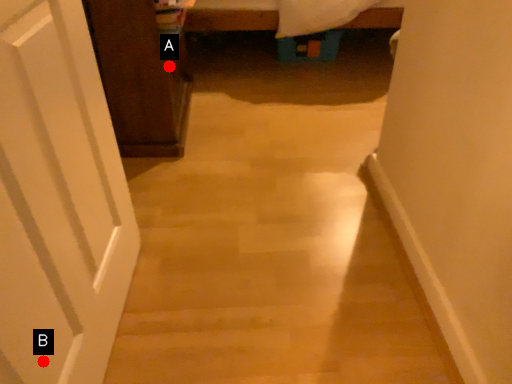
Question: Two points are circled on the image, labeled by A and B beside each circle. Which of the following is the closest to the observer?

Choices:
 (A) A is closer
 (B) B is closer

Answer: (B)